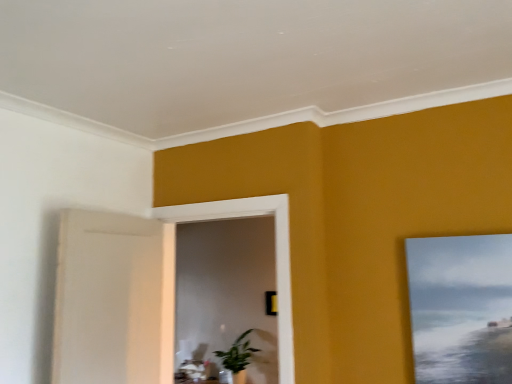
Question: Could you tell me if white wooden frame at center is facing green glossy plant at center?

Choices:
 (A) no
 (B) yes

Answer: (A)

Question: From a real-world perspective, is white wooden frame at center on top of green glossy plant at center?

Choices:
 (A) no
 (B) yes

Answer: (B)

Question: From the image's perspective, is white wooden frame at center beneath green glossy plant at center?

Choices:
 (A) yes
 (B) no

Answer: (B)

Question: Is white wooden frame at center to the left of green glossy plant at center from the viewer's perspective?

Choices:
 (A) no
 (B) yes

Answer: (B)

Question: Can you confirm if white wooden frame at center is wider than green glossy plant at center?

Choices:
 (A) yes
 (B) no

Answer: (B)

Question: In the image, is white wooden frame at center positioned in front of or behind green glossy plant at center?

Choices:
 (A) front
 (B) behind

Answer: (A)

Question: From a real-world perspective, is white wooden frame at center above or below green glossy plant at center?

Choices:
 (A) below
 (B) above

Answer: (B)

Question: From their relative heights in the image, would you say white wooden frame at center is taller or shorter than green glossy plant at center?

Choices:
 (A) tall
 (B) short

Answer: (A)

Question: Is point (288, 329) positioned closer to the camera than point (224, 360)?

Choices:
 (A) closer
 (B) farther

Answer: (A)

Question: From a real-world perspective, relative to matte canvas painting at upper right, is white wooden frame at center vertically above or below?

Choices:
 (A) below
 (B) above

Answer: (B)

Question: Is white wooden frame at center wider or thinner than matte canvas painting at upper right?

Choices:
 (A) thin
 (B) wide

Answer: (B)

Question: Considering the relative positions of white wooden frame at center and matte canvas painting at upper right in the image provided, is white wooden frame at center to the left or to the right of matte canvas painting at upper right?

Choices:
 (A) right
 (B) left

Answer: (B)

Question: In terms of size, does white wooden frame at center appear bigger or smaller than matte canvas painting at upper right?

Choices:
 (A) big
 (B) small

Answer: (A)

Question: Does point (230, 367) appear closer or farther from the camera than point (415, 370)?

Choices:
 (A) farther
 (B) closer

Answer: (A)

Question: Is green glossy plant at center taller or shorter than matte canvas painting at upper right?

Choices:
 (A) tall
 (B) short

Answer: (B)